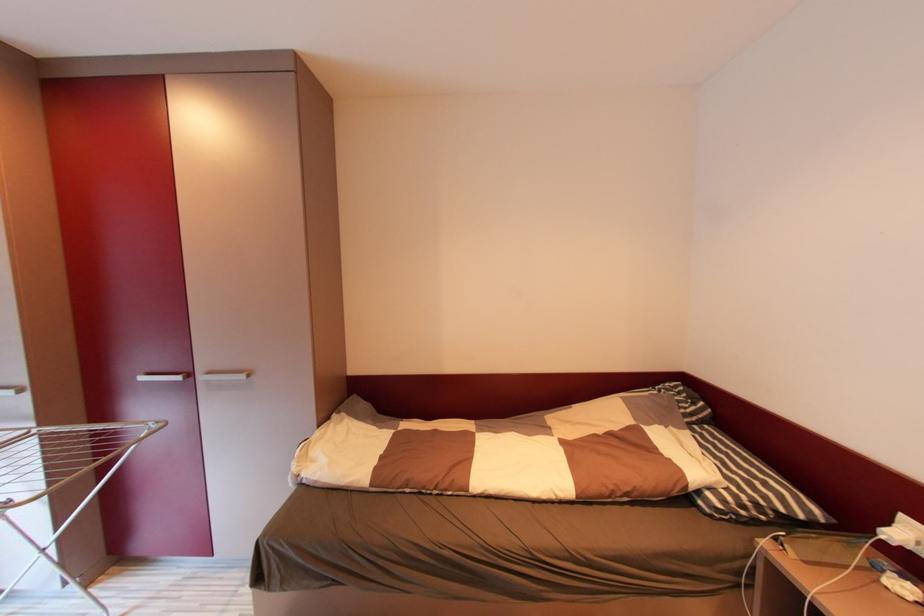
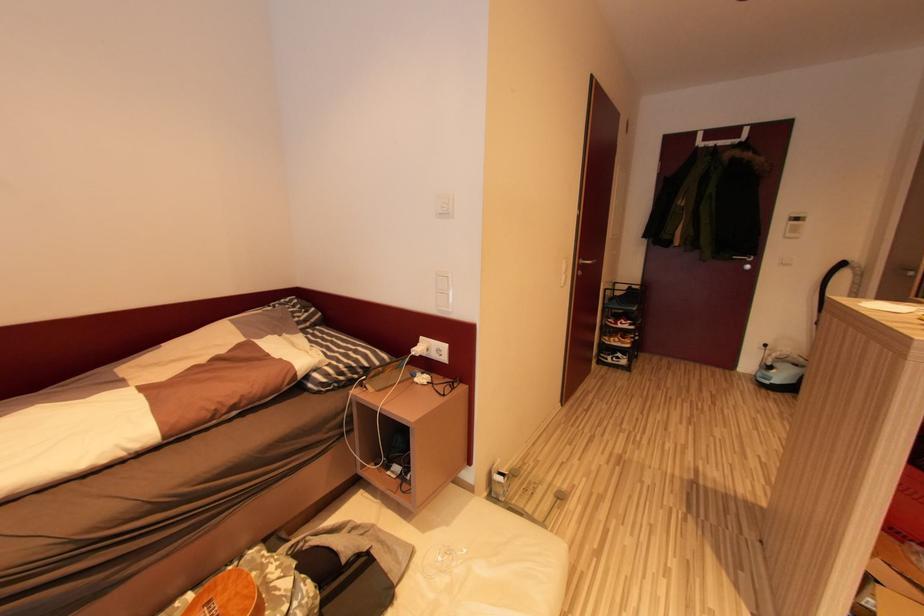
Question: The camera is either moving clockwise (left) or counter-clockwise (right) around the object. The first image is from the beginning of the video and the second image is from the end. Is the camera moving left or right when shooting the video?

Choices:
 (A) Left
 (B) Right

Answer: (A)